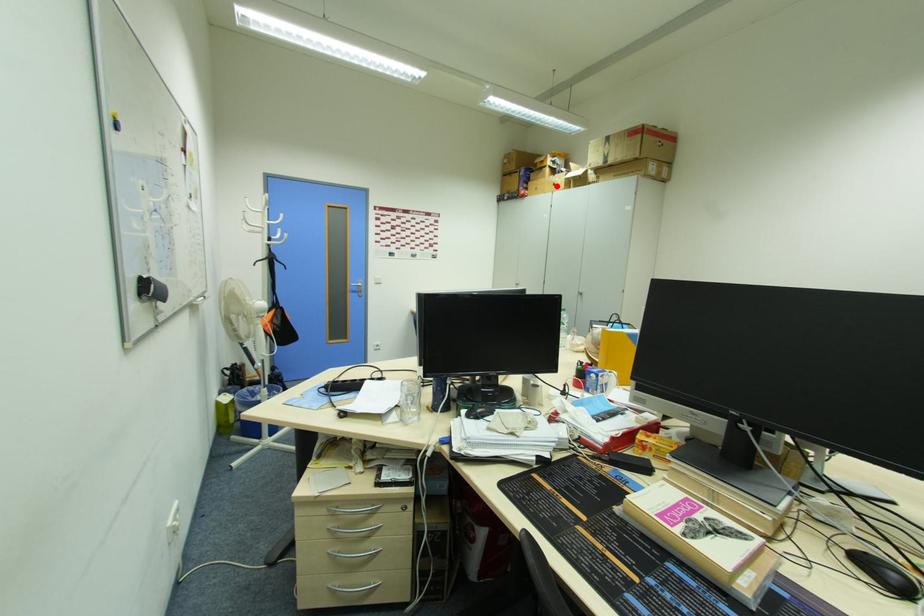
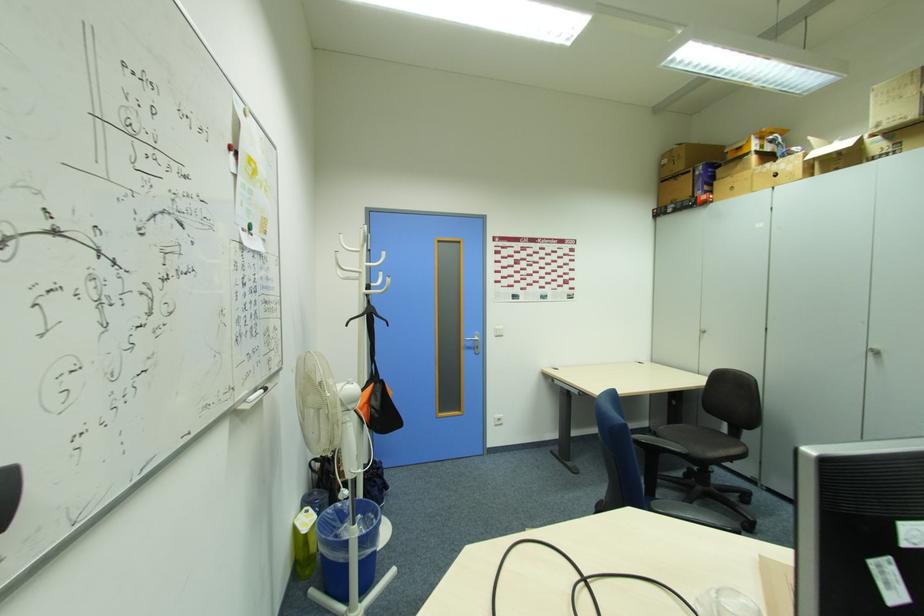
The point at the highlighted location is marked in the first image. Where is the corresponding point in the second image?

(779, 176)